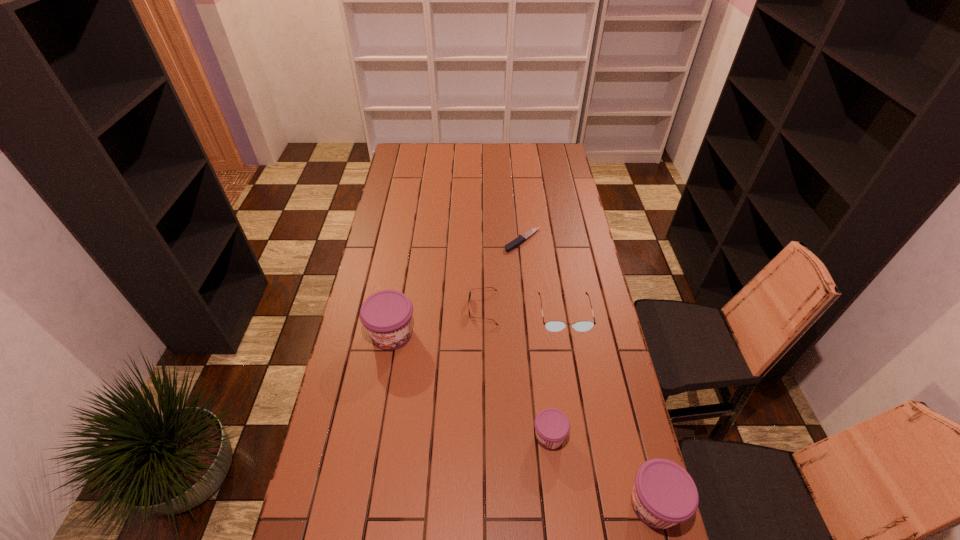
To achieve even spacing by inserting another jam among them, please point to a vacant spot for this new jam. Please provide its 2D coordinates. Your answer should be formatted as a tuple, i.e. [(x, y)], where the tuple contains the x and y coordinates of a point satisfying the conditions above.

[(464, 381)]